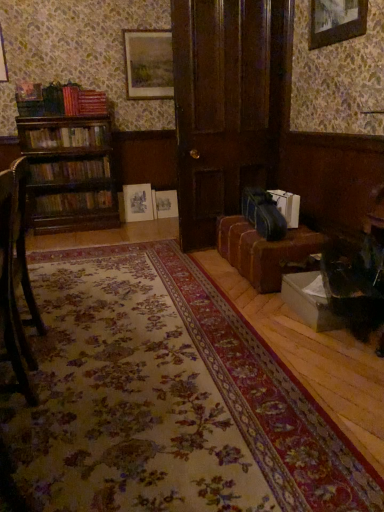
Question: From a real-world perspective, is dark wood door at center on white paper bag at lower right, which ranks as the 1th book in right-to-left order?

Choices:
 (A) no
 (B) yes

Answer: (B)

Question: Is dark wood door at center to the left of white paper bag at lower right, which ranks as the 1th book in right-to-left order, from the viewer's perspective?

Choices:
 (A) yes
 (B) no

Answer: (A)

Question: Is dark wood door at center closer to camera compared to white paper bag at lower right, the first book from the front?

Choices:
 (A) no
 (B) yes

Answer: (B)

Question: Is dark wood door at center bigger than white paper bag at lower right, which is counted as the fourth book, starting from the left?

Choices:
 (A) yes
 (B) no

Answer: (A)

Question: Does dark wood door at center have a greater height compared to white paper bag at lower right, which ranks as the 1th book in right-to-left order?

Choices:
 (A) yes
 (B) no

Answer: (A)

Question: Based on their positions, is wooden bookshelf at left, the 2th book when ordered from top to bottom, located to the left or right of white paper bag at lower right, the first book from the front?

Choices:
 (A) left
 (B) right

Answer: (A)

Question: Is point (105, 157) closer or farther from the camera than point (294, 199)?

Choices:
 (A) farther
 (B) closer

Answer: (A)

Question: From the image's perspective, is wooden bookshelf at left, placed as the third book when sorted from bottom to top, above or below white paper bag at lower right, which ranks as the 1th book in right-to-left order?

Choices:
 (A) above
 (B) below

Answer: (A)

Question: In terms of size, does wooden bookshelf at left, which is counted as the 2th book, starting from the back, appear bigger or smaller than white paper bag at lower right, which is counted as the 4th book, starting from the back?

Choices:
 (A) small
 (B) big

Answer: (B)

Question: Considering the positions of dark wood door at center and brown leather couch at lower right in the image, is dark wood door at center wider or thinner than brown leather couch at lower right?

Choices:
 (A) thin
 (B) wide

Answer: (A)

Question: Is dark wood door at center bigger or smaller than brown leather couch at lower right?

Choices:
 (A) small
 (B) big

Answer: (B)

Question: In the image, is dark wood door at center on the left side or the right side of brown leather couch at lower right?

Choices:
 (A) right
 (B) left

Answer: (B)

Question: Considering their positions, is dark wood door at center located in front of or behind brown leather couch at lower right?

Choices:
 (A) front
 (B) behind

Answer: (B)

Question: From the image's perspective, is matte wooden picture frame at upper center, acting as the second picture frame starting from the right, positioned above or below wooden chair at left?

Choices:
 (A) above
 (B) below

Answer: (A)

Question: Looking at their shapes, would you say matte wooden picture frame at upper center, which appears as the 1th picture frame when viewed from the back, is wider or thinner than wooden chair at left?

Choices:
 (A) thin
 (B) wide

Answer: (A)